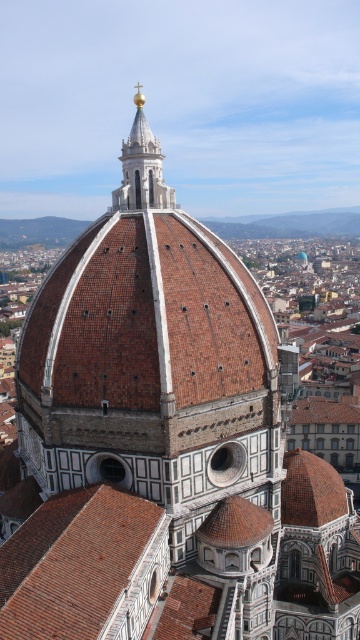
Question: Is brown tiled roof at center closer to the viewer compared to polished gold spire at upper center?

Choices:
 (A) no
 (B) yes

Answer: (B)

Question: Does brown tiled roof at center appear on the right side of polished gold spire at upper center?

Choices:
 (A) no
 (B) yes

Answer: (B)

Question: Which point is farther to the camera?

Choices:
 (A) polished gold spire at upper center
 (B) brown tiled roof at center

Answer: (A)

Question: Which point appears closest to the camera in this image?

Choices:
 (A) (146, 148)
 (B) (124, 577)

Answer: (B)

Question: Is the position of brown tiled roof at center less distant than that of polished gold spire at upper center?

Choices:
 (A) no
 (B) yes

Answer: (B)